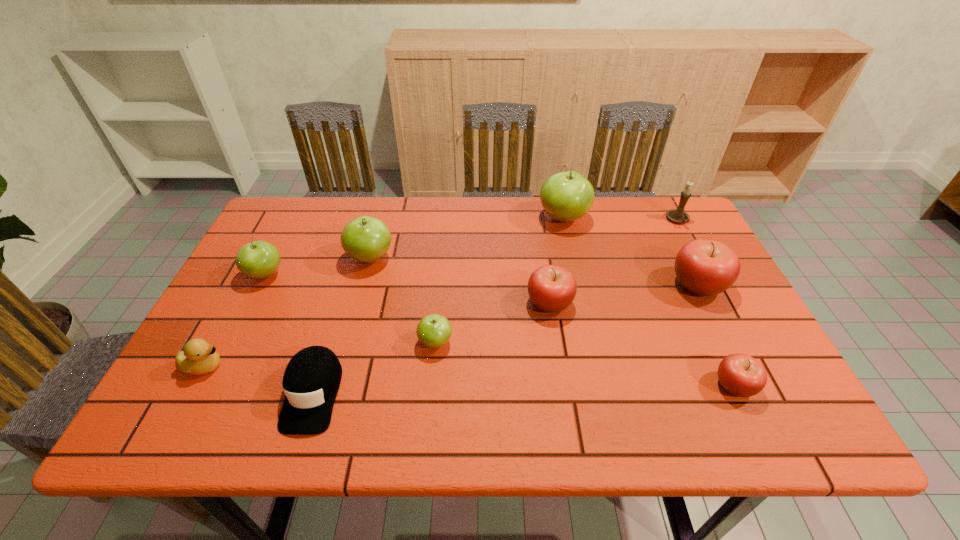
Where is `object that is at the far right corner`? The height and width of the screenshot is (540, 960). object that is at the far right corner is located at coordinates (678, 215).

Locate an element on the screen. The height and width of the screenshot is (540, 960). object that is at the near right corner is located at coordinates (739, 374).

Locate an element on the screen. The height and width of the screenshot is (540, 960). free space at the far edge is located at coordinates (335, 220).

In the image, there is a desktop. Identify the location of free region at the near edge. The height and width of the screenshot is (540, 960). click(x=423, y=435).

The width and height of the screenshot is (960, 540). I want to click on vacant space at the left edge of the desktop, so click(x=289, y=289).

Identify the location of vacant space at the right edge. (708, 336).

Image resolution: width=960 pixels, height=540 pixels. I want to click on free location at the far left corner of the desktop, so click(267, 219).

I want to click on vacant point at the near left corner, so click(x=173, y=406).

Find the location of a particular element. vacant space at the far right corner of the desktop is located at coordinates (656, 203).

The height and width of the screenshot is (540, 960). I want to click on vacant space at the near right corner of the desktop, so click(745, 421).